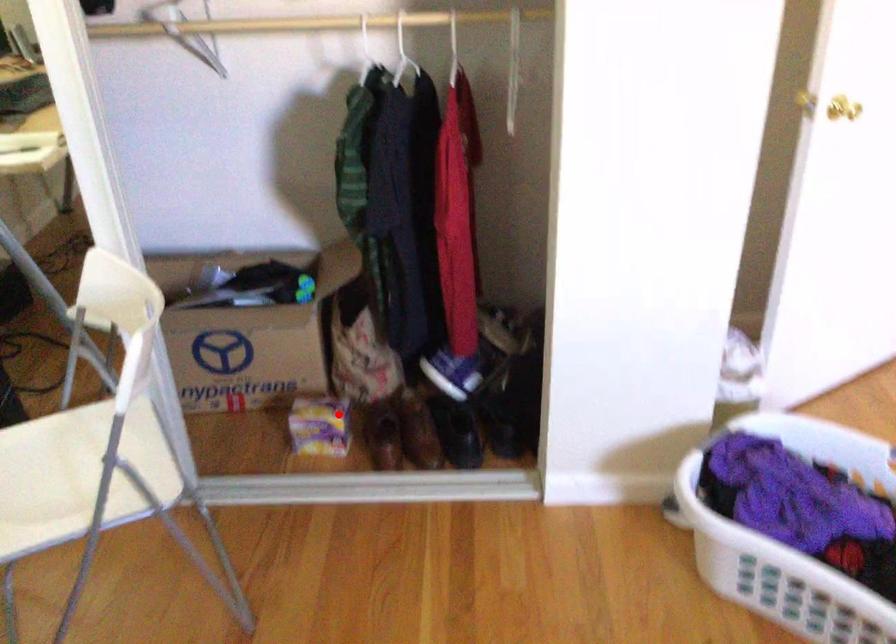
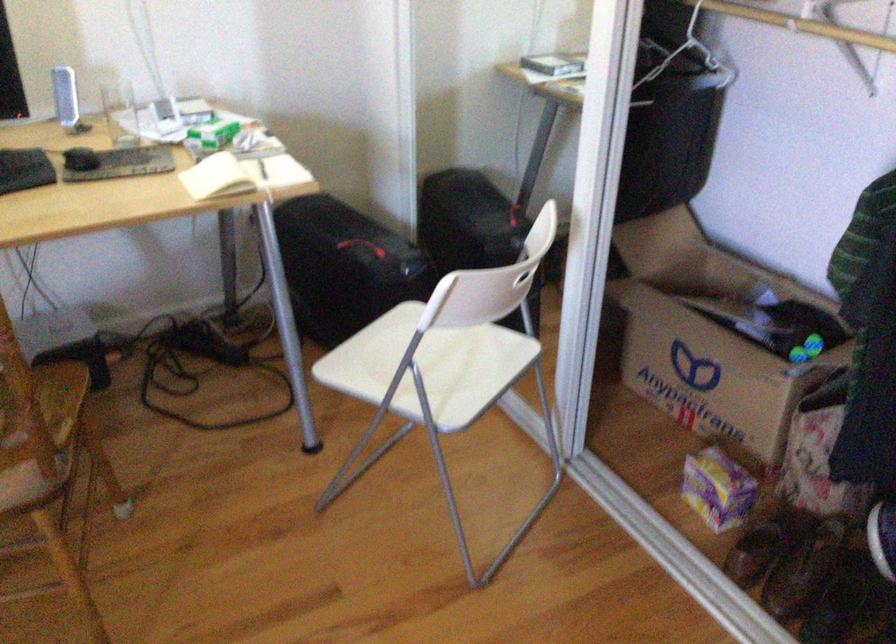
The point at the highlighted location is marked in the first image. Where is the corresponding point in the second image?

(718, 489)